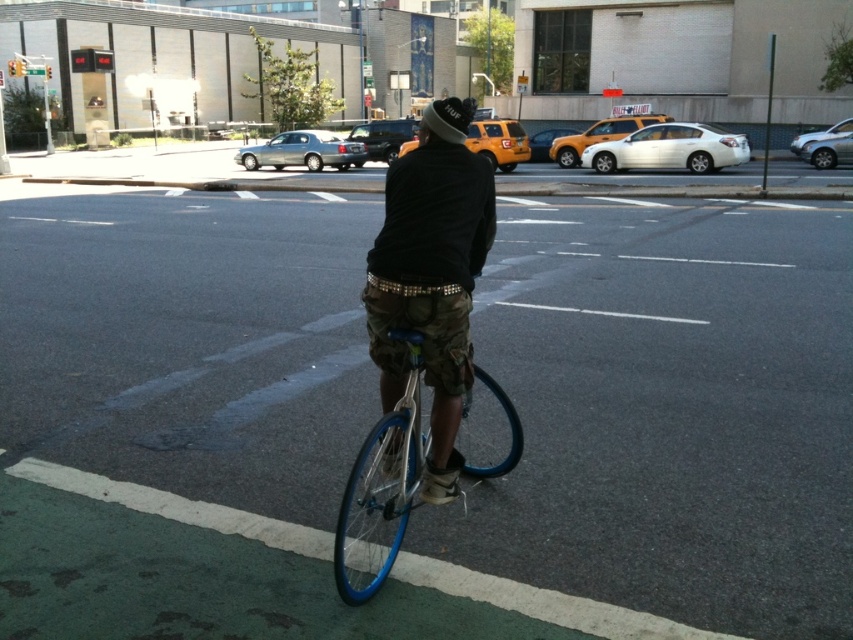
You are a delivery person who needs to place a package on the ground. The green asphalt bike lane at center and the camouflage shorts at center are both visible. Which surface is more appropriate for placing the package?

The green asphalt bike lane at center is more appropriate for placing the package since it is a solid surface, whereas the camouflage shorts at center are clothing and not a stable surface for placing items.

You are a delivery driver who needs to make a right turn onto the next street. The bike lane is marked by a green painted surface. Where is the green asphalt bike lane located in relation to the point you are currently at, which is at coordinates point (670, 412)?

The point (670, 412) marks the green asphalt bike lane at center, so you are currently located exactly at the center of the bike lane.